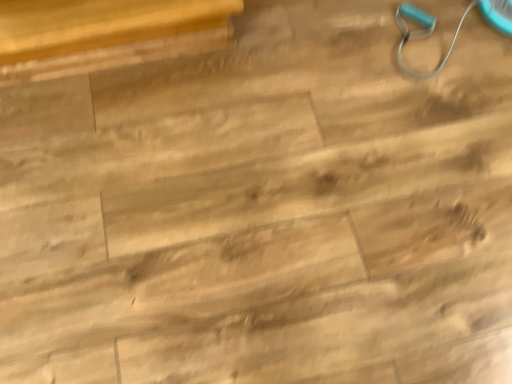
What do you see at coordinates (104, 34) in the screenshot?
I see `wooden table at upper left` at bounding box center [104, 34].

Measure the distance between wooden table at upper left and camera.

1.10 meters.

At what (x,y) coordinates should I click in order to perform the action: click on wooden table at upper left. Please return your answer as a coordinate pair (x, y). Looking at the image, I should click on (104, 34).

At what (x,y) coordinates should I click in order to perform the action: click on wooden table at upper left. Please return your answer as a coordinate pair (x, y). The width and height of the screenshot is (512, 384). Looking at the image, I should click on (104, 34).